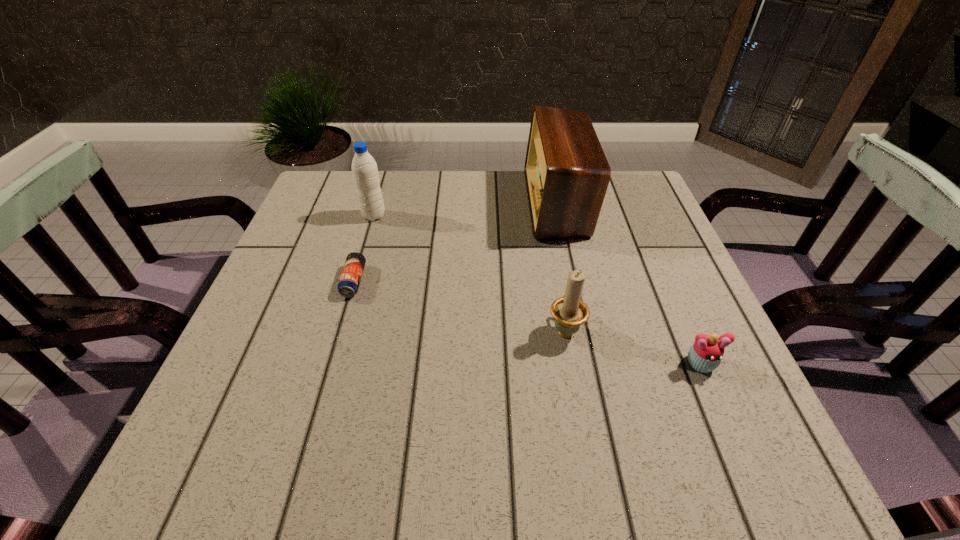
Find the location of a particular element. Image resolution: width=960 pixels, height=540 pixels. vacant point located on the front-facing side of the radio receiver is located at coordinates (457, 202).

The height and width of the screenshot is (540, 960). I want to click on vacant space located on the right of the water bottle, so click(x=471, y=216).

Where is `vacant space located 0.290m on the handle side of the fourth farthest object`? The image size is (960, 540). vacant space located 0.290m on the handle side of the fourth farthest object is located at coordinates (546, 226).

Identify the location of vacant space located 0.060m on the handle side of the fourth farthest object. (558, 291).

Locate an element on the screen. blank space located 0.250m on the handle side of the fourth farthest object is located at coordinates (548, 235).

I want to click on vacant area situated on the face of the cupcake, so pyautogui.click(x=735, y=448).

This screenshot has height=540, width=960. Find the location of `vacant space located 0.270m on the front of the beer can`. vacant space located 0.270m on the front of the beer can is located at coordinates (314, 418).

This screenshot has width=960, height=540. In order to click on radio receiver present at the far edge in this screenshot , I will do `click(567, 174)`.

Find the location of `water bottle that is at the far edge`. water bottle that is at the far edge is located at coordinates (364, 168).

Find the location of a particular element. object that is at the left edge is located at coordinates (364, 168).